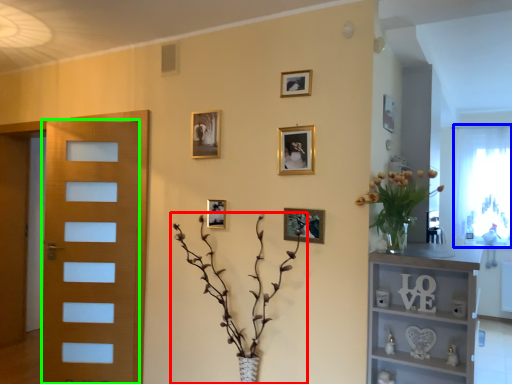
Question: Considering the real-world distances, which object is farthest from houseplant (highlighted by a red box)? window screen (highlighted by a blue box) or door (highlighted by a green box)?

Choices:
 (A) window screen
 (B) door

Answer: (A)